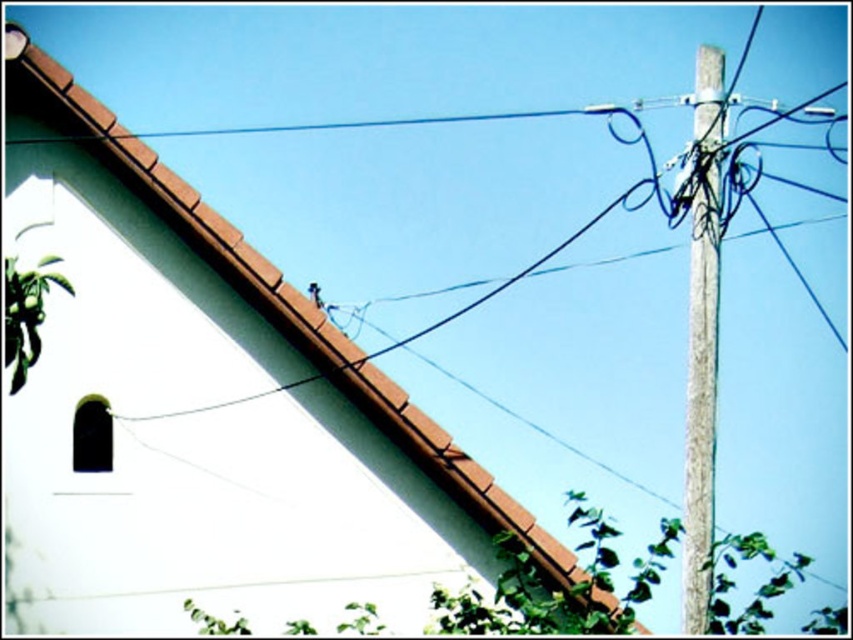
You are an architect analyzing the building layout. The brown tile roof at upper left and gray concrete pole at right are part of the structure. Which of these two has a smaller width?

The brown tile roof at upper left has a smaller width than the gray concrete pole at right.

Consider the image. You are standing in the middle of the scene and want to look at both the brown tile roof at upper left and the gray concrete pole at right. Which object should you look towards first if you want to see the one that is positioned to the left?

The brown tile roof at upper left is to the left of the gray concrete pole at right, so you should look towards the brown tile roof at upper left first.